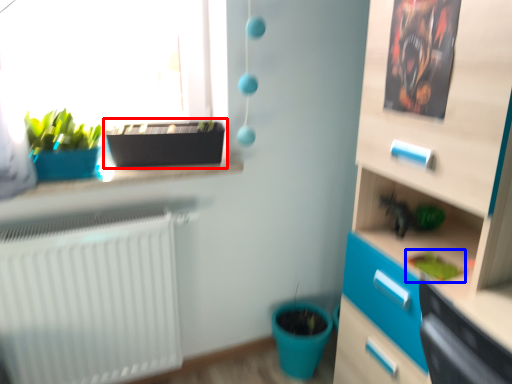
Question: Among these objects, which one is nearest to the camera, flowerpot (highlighted by a red box) or plant (highlighted by a blue box)?

Choices:
 (A) flowerpot
 (B) plant

Answer: (B)